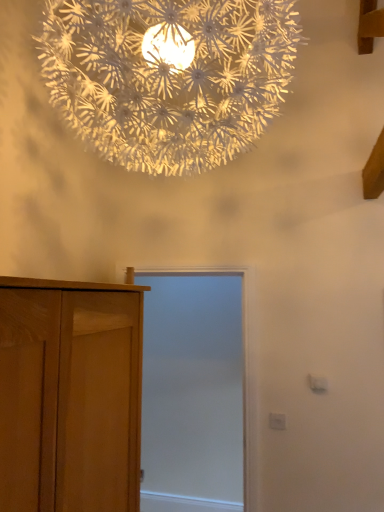
Question: Based on their sizes in the image, would you say white paper-like at upper center is bigger or smaller than light brown wooden cupboard at left?

Choices:
 (A) small
 (B) big

Answer: (B)

Question: Which is correct: white paper-like at upper center is inside light brown wooden cupboard at left, or outside of it?

Choices:
 (A) inside
 (B) outside

Answer: (B)

Question: Estimate the real-world distances between objects in this image. Which object is farther from the light brown wooden cupboard at left?

Choices:
 (A) white matte screen door at center
 (B) white paper-like at upper center

Answer: (A)

Question: Based on their relative distances, which object is farther from the light brown wooden cupboard at left?

Choices:
 (A) white matte screen door at center
 (B) white paper-like at upper center

Answer: (A)